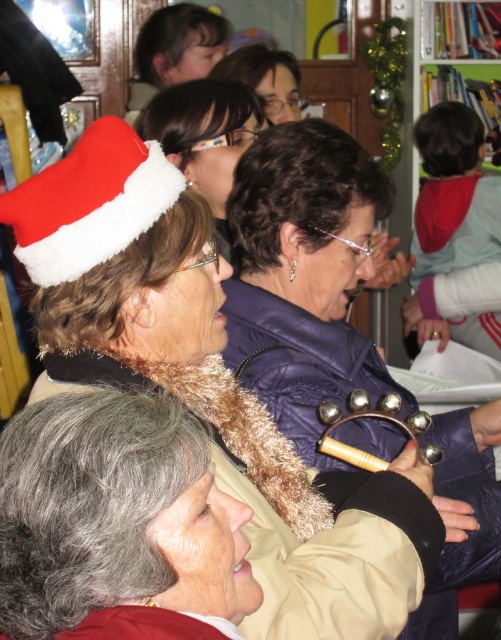
Question: Which point is closer to the camera?

Choices:
 (A) click(x=297, y=83)
 (B) click(x=314, y=228)
 (C) click(x=221, y=252)
 (D) click(x=38, y=273)

Answer: (D)

Question: Which is farther from the matte purple jacket at center?

Choices:
 (A) red velvet santa hat at upper left
 (B) purple fuzzy jacket at center

Answer: (A)

Question: Is red velvet santa hat at upper left positioned at the back of matte purple jacket at center?

Choices:
 (A) no
 (B) yes

Answer: (A)

Question: From the image, what is the correct spatial relationship of matte black santa hat at upper center in relation to matte purple jacket at center?

Choices:
 (A) above
 (B) below

Answer: (B)

Question: Does red velvet santa hat at upper left appear under matte black santa hat at upper center?

Choices:
 (A) yes
 (B) no

Answer: (A)

Question: Which object is positioned farthest from the matte purple jacket at center?

Choices:
 (A) purple fuzzy jacket at center
 (B) red velvet santa hat at upper left

Answer: (B)